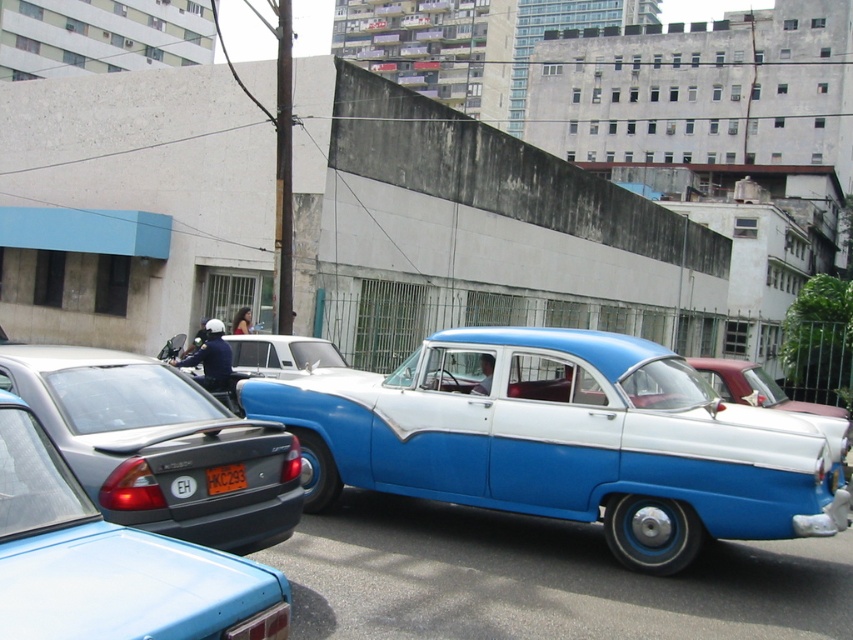
Question: Which of these objects is positioned farthest from the blue metallic car at center?

Choices:
 (A) matte black sedan at lower left
 (B) yellow plastic license plate at center

Answer: (B)

Question: Can you confirm if blue metallic car at center is wider than yellow plastic license plate at center?

Choices:
 (A) yes
 (B) no

Answer: (A)

Question: Is blue metallic car at center thinner than matte black sedan at lower left?

Choices:
 (A) yes
 (B) no

Answer: (B)

Question: Can you confirm if blue metallic car at center is positioned below matte black sedan at lower left?

Choices:
 (A) no
 (B) yes

Answer: (B)

Question: Which of these objects is positioned farthest from the matte black sedan at lower left?

Choices:
 (A) yellow plastic license plate at center
 (B) blue metallic car at center

Answer: (B)

Question: Which point is farther to the camera?

Choices:
 (A) (178, 536)
 (B) (611, 515)

Answer: (B)